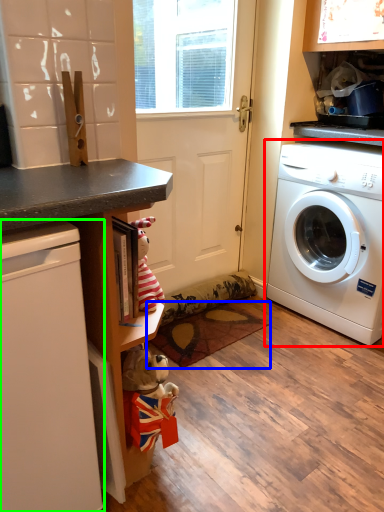
Question: Which object is positioned closest to washing machine (highlighted by a red box)? Select from mat (highlighted by a blue box) and dish washer (highlighted by a green box).

Choices:
 (A) mat
 (B) dish washer

Answer: (A)